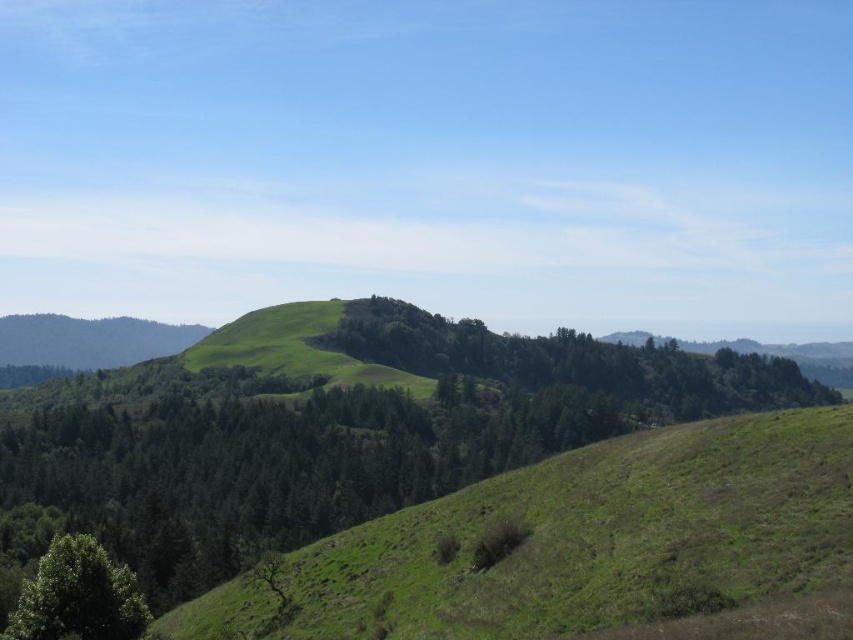
Question: Can you confirm if green leafy tree at center is bigger than green leafy tree at lower left?

Choices:
 (A) no
 (B) yes

Answer: (B)

Question: Which point is closer to the camera?

Choices:
 (A) green leafy tree at center
 (B) green leafy tree at lower left

Answer: (A)

Question: Which object appears closest to the camera in this image?

Choices:
 (A) green leafy tree at lower left
 (B) green leafy tree at center

Answer: (B)

Question: Is green leafy tree at center to the right of green leafy tree at lower left from the viewer's perspective?

Choices:
 (A) yes
 (B) no

Answer: (A)

Question: Is green leafy tree at center below green leafy tree at lower left?

Choices:
 (A) yes
 (B) no

Answer: (B)